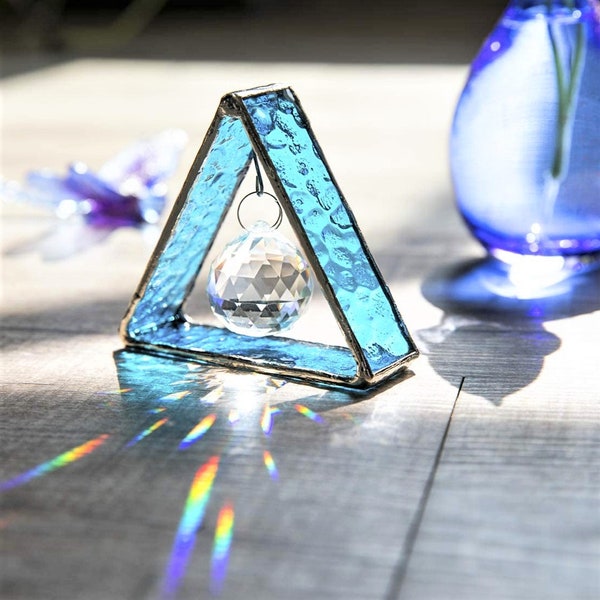
Locate an element on the screen. cup is located at coordinates (539, 155).